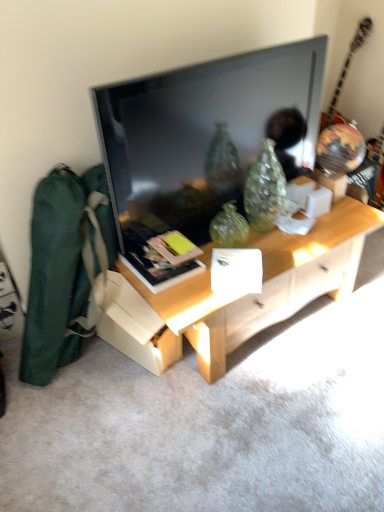
Where is `vacant area that lies between light wood desk at center and green canvas messenger bag at left`? vacant area that lies between light wood desk at center and green canvas messenger bag at left is located at coordinates pos(120,386).